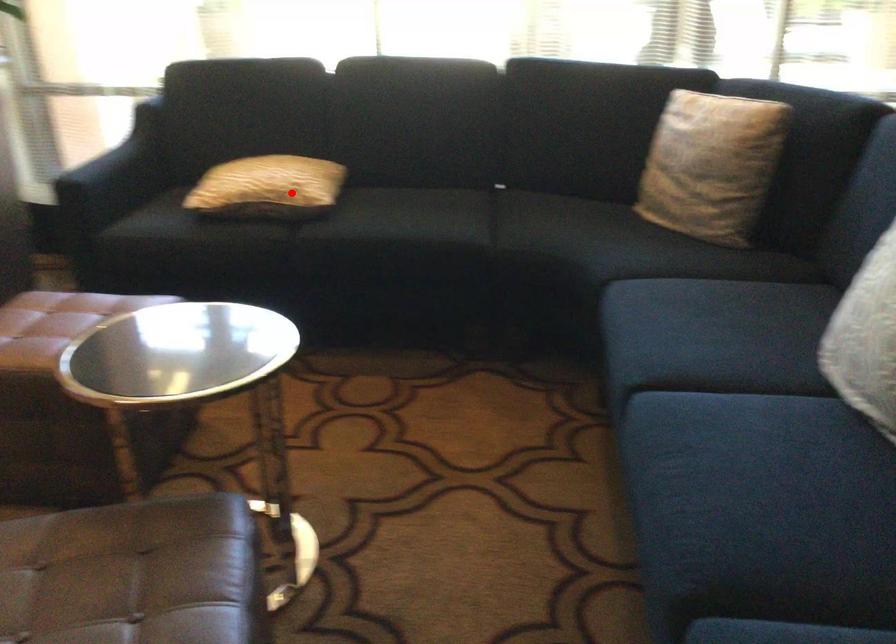
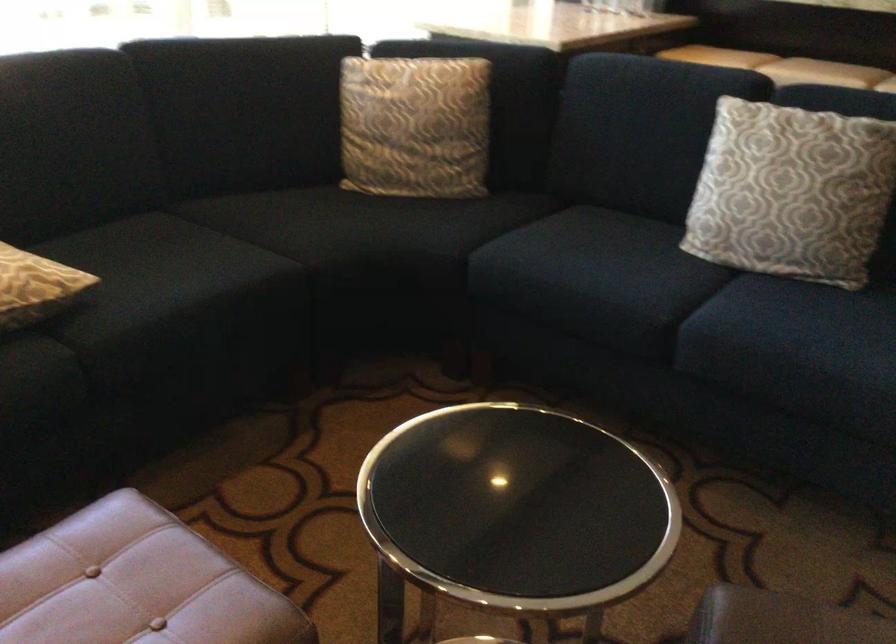
Question: I am providing you with two images of the same scene from different viewpoints. In image1, a red point is highlighted. Considering the same 3D point in image2, which of the following is correct?

Choices:
 (A) It is closer
 (B) It is farther

Answer: (A)